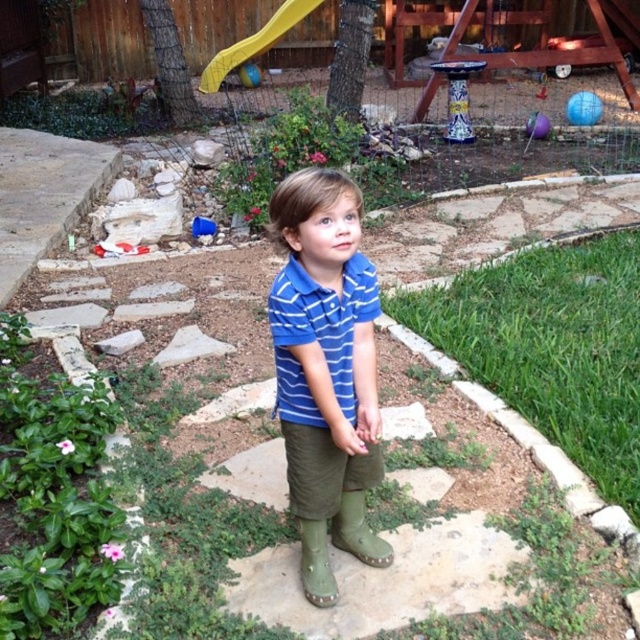
Is point (602, 438) positioned after point (320, 289)?

Yes, it is.

Is the position of green grass at lower right less distant than that of blue striped shirt at center?

No.

Is point (579, 378) positioned after point (326, 448)?

Yes, point (579, 378) is farther from viewer.

The width and height of the screenshot is (640, 640). What are the coordinates of `green grass at lower right` in the screenshot? It's located at (552, 346).

How far apart are blue striped polo shirt at center and green rubber boot at lower center?

They are 17.42 inches apart.

From the picture: Between blue striped polo shirt at center and green rubber boot at lower center, which one is positioned higher?

blue striped polo shirt at center is above.

Does point (284, 316) come farther from viewer compared to point (314, 525)?

No, it is not.

Identify the location of blue striped polo shirt at center. (317, 333).

Is green grass at lower right closer to camera compared to green rubber boot at center?

No.

Does green grass at lower right come behind green rubber boot at center?

Yes, it is behind green rubber boot at center.

I want to click on green grass at lower right, so click(552, 346).

You are a GUI agent. You are given a task and a screenshot of the screen. Output one action in this format:
    pyautogui.click(x=<x>, y=<y>)
    Task: Click on the green grass at lower right
    This screenshot has height=640, width=640.
    Given the screenshot: What is the action you would take?
    pyautogui.click(x=552, y=346)